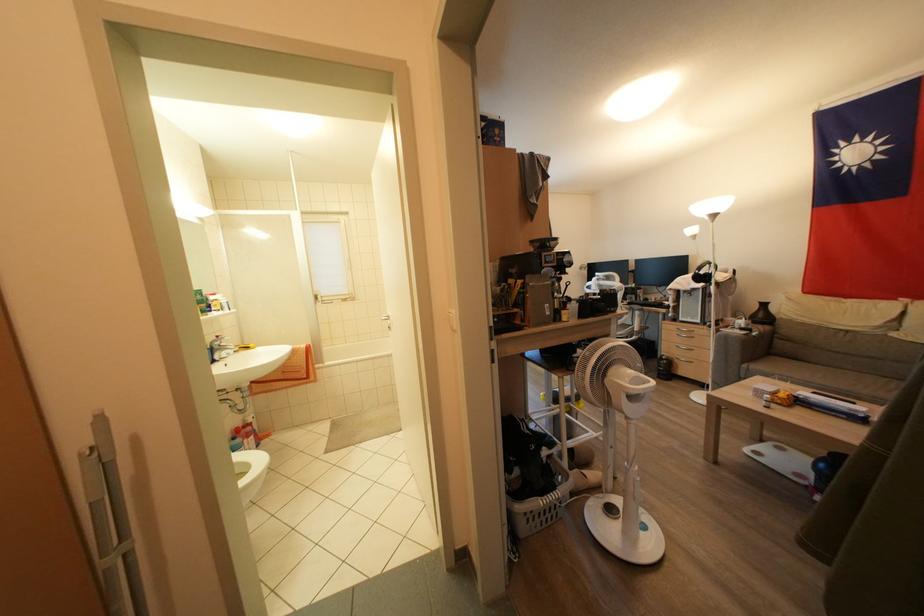
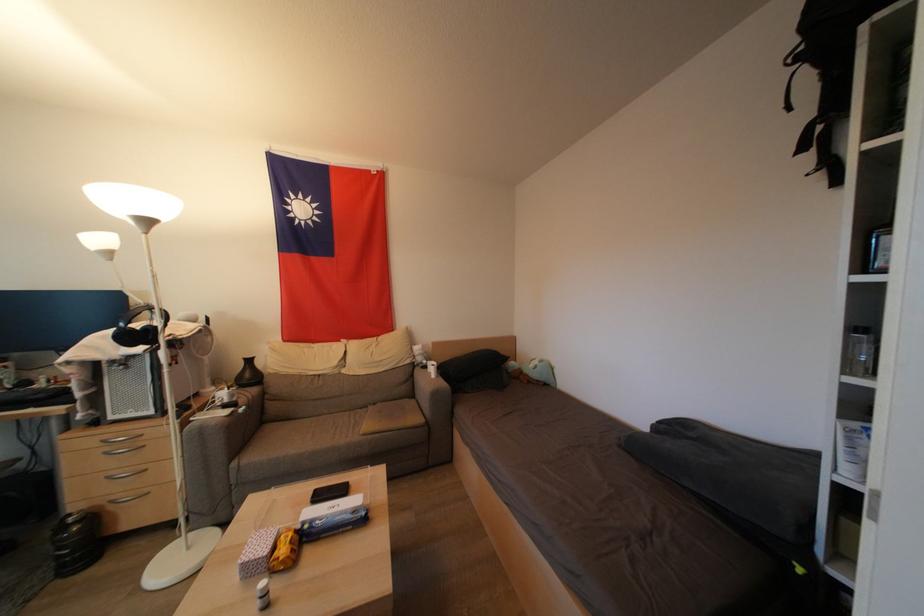
The point at (780, 398) is marked in the first image. Where is the corresponding point in the second image?

(277, 553)